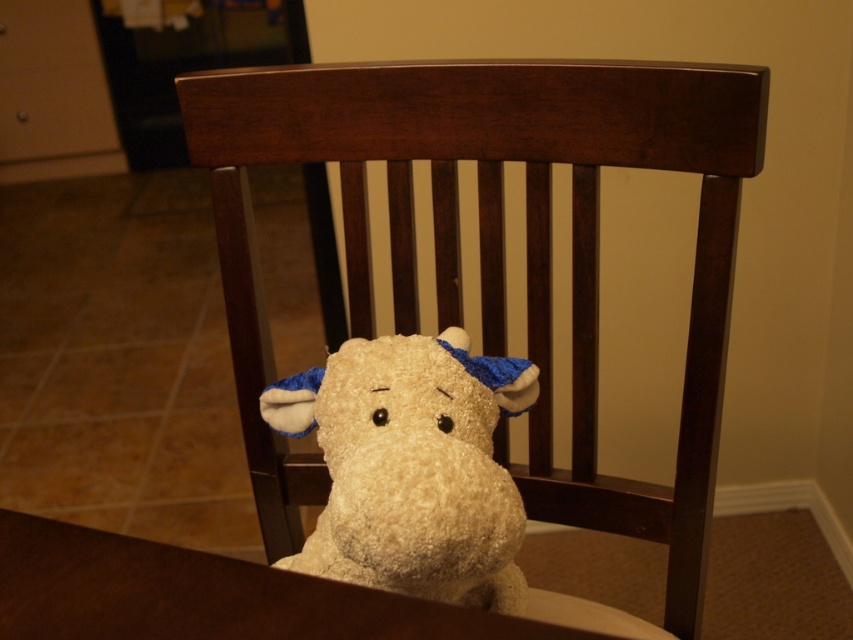
Question: Considering the real-world distances, which object is farthest from the fluffy beige stuffed animal at center?

Choices:
 (A) fluffy white stuffed animal at center
 (B) wooden rocking chair at center

Answer: (B)

Question: From the image, what is the correct spatial relationship of fluffy white stuffed animal at center in relation to fluffy beige stuffed animal at center?

Choices:
 (A) above
 (B) below

Answer: (A)

Question: Considering the relative positions of fluffy white stuffed animal at center and fluffy beige stuffed animal at center in the image provided, where is fluffy white stuffed animal at center located with respect to fluffy beige stuffed animal at center?

Choices:
 (A) left
 (B) right

Answer: (B)

Question: Which of the following is the closest to the observer?

Choices:
 (A) (440, 385)
 (B) (440, 257)

Answer: (A)

Question: Which point is closer to the camera?

Choices:
 (A) (369, 278)
 (B) (323, 554)
 (C) (165, 611)

Answer: (C)

Question: Is wooden rocking chair at center further to camera compared to fluffy beige stuffed animal at center?

Choices:
 (A) yes
 (B) no

Answer: (A)